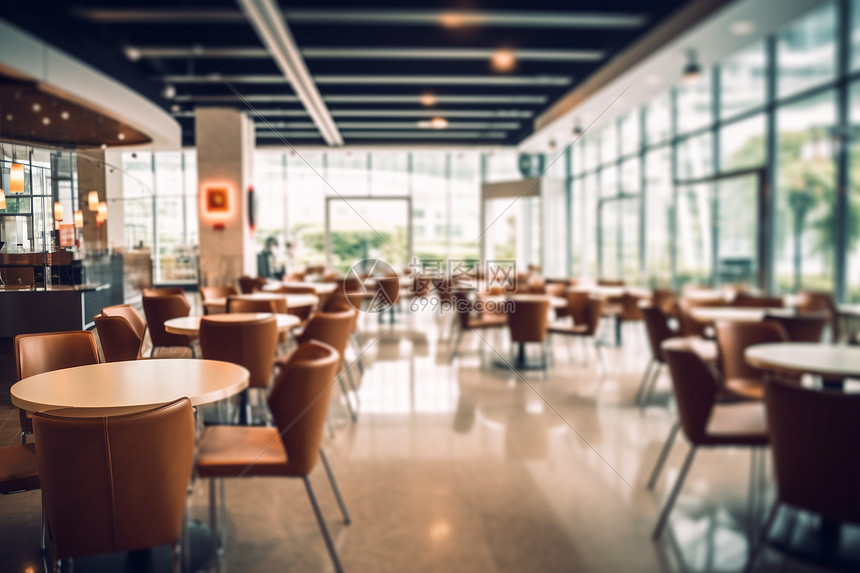
Where is `tables`? The image size is (860, 573). tables is located at coordinates (210, 376), (187, 325), (297, 303), (328, 286), (559, 302), (740, 317), (610, 293), (785, 359).